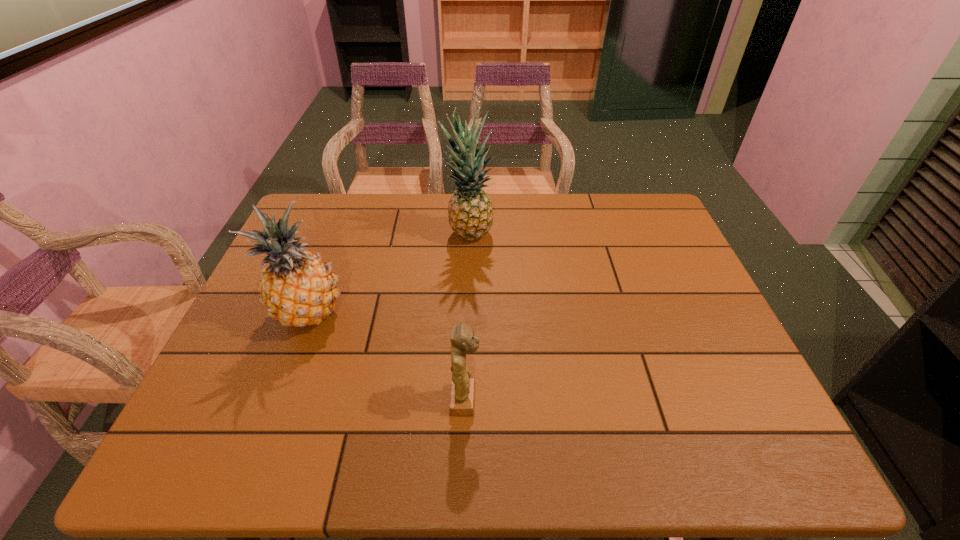
This screenshot has height=540, width=960. Find the location of `the farthest object`. the farthest object is located at coordinates (470, 213).

At what (x,y) coordinates should I click in order to perform the action: click on the right pineapple. Please return your answer as a coordinate pair (x, y). This screenshot has width=960, height=540. Looking at the image, I should click on (470, 213).

You are a GUI agent. You are given a task and a screenshot of the screen. Output one action in this format:
    pyautogui.click(x=<x>, y=<y>)
    Task: Click on the second farthest object
    The image size is (960, 540).
    Given the screenshot: What is the action you would take?
    pyautogui.click(x=298, y=288)

Locate an element on the screen. The width and height of the screenshot is (960, 540). the second tallest object is located at coordinates (298, 288).

Find the location of `the shortest object`. the shortest object is located at coordinates (462, 395).

Where is `figurine`? figurine is located at coordinates click(x=462, y=395).

At what (x,y) coordinates should I click in order to perform the action: click on vacant area situated on the front of the right pineapple. Please return your answer as a coordinate pair (x, y). The width and height of the screenshot is (960, 540). Looking at the image, I should click on 468,286.

The width and height of the screenshot is (960, 540). I want to click on free space located on the back of the shorter pineapple, so click(x=344, y=219).

This screenshot has width=960, height=540. In order to click on free space located on the front-facing side of the figurine in this screenshot , I will do `click(549, 400)`.

Find the location of a particular element. This screenshot has height=540, width=960. object that is positioned at the far edge is located at coordinates (470, 213).